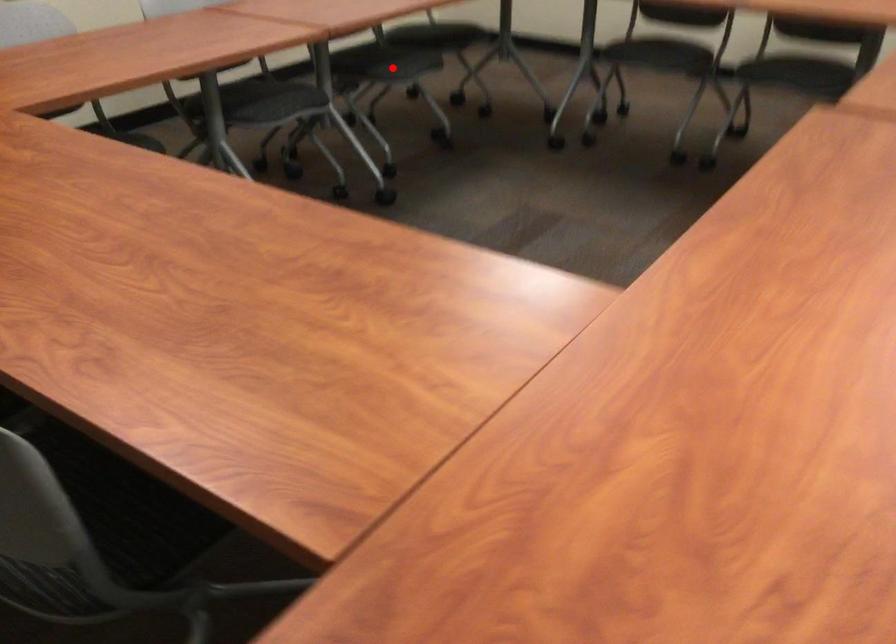
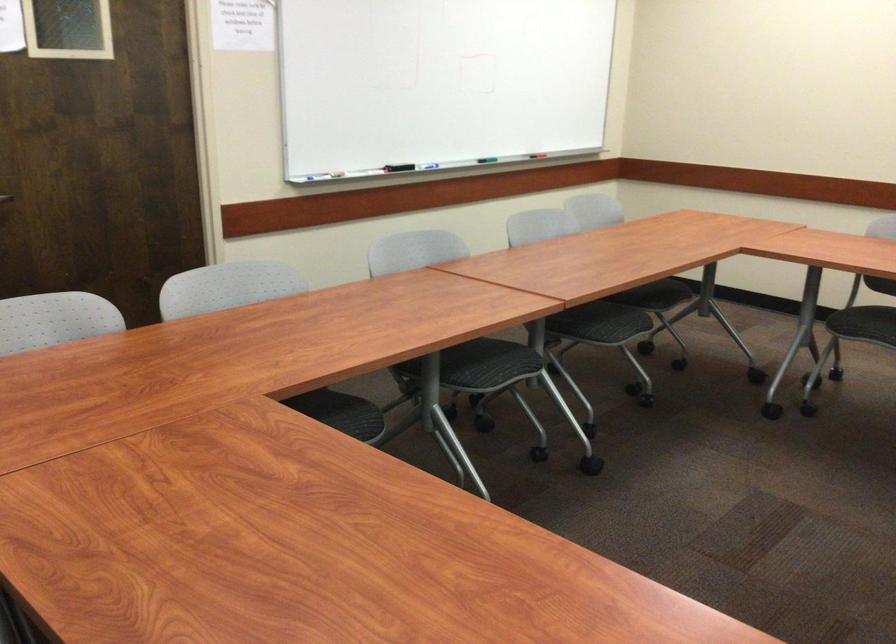
Question: I am providing you with two images of the same scene from different viewpoints. A red point is marked on the first image. Can you still see the location of the red point in image 2?

Choices:
 (A) Yes
 (B) No

Answer: (A)